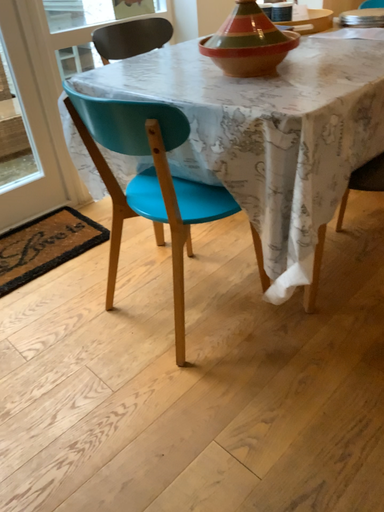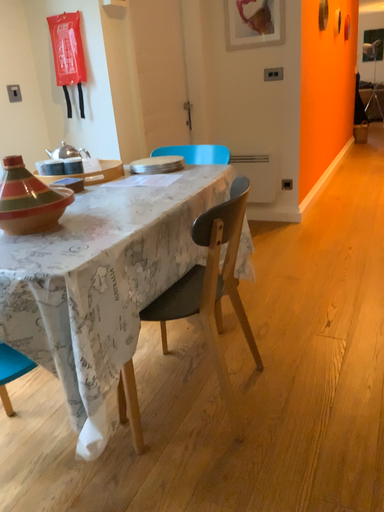
Question: How did the camera likely rotate when shooting the video?

Choices:
 (A) rotated upward
 (B) rotated downward

Answer: (A)